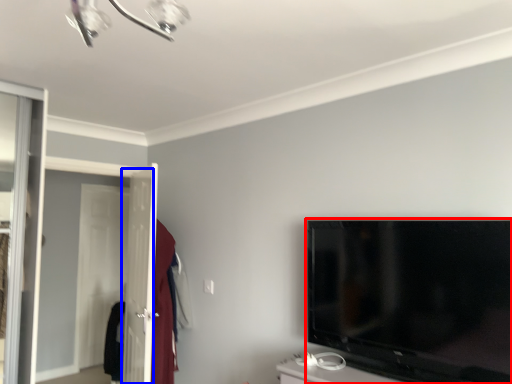
Question: Which object is further to the camera taking this photo, television (highlighted by a red box) or screen door (highlighted by a blue box)?

Choices:
 (A) television
 (B) screen door

Answer: (B)